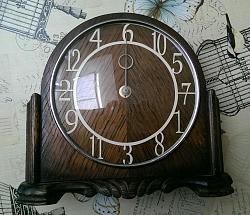
This screenshot has height=215, width=250. Find the location of `clock`. clock is located at coordinates (124, 92).